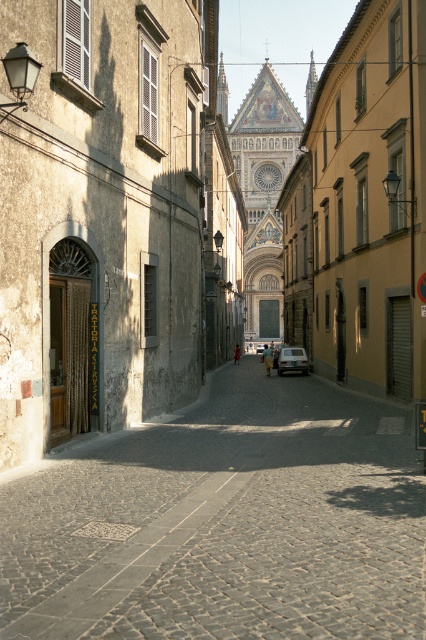
Question: In this image, where is stone paved street at center located relative to gray cobblestone alley at center?

Choices:
 (A) below
 (B) above

Answer: (B)

Question: Considering the real-world distances, which object is farthest from the silver metallic car at center?

Choices:
 (A) gray cobblestone alley at center
 (B) stone paved street at center

Answer: (A)

Question: Which point appears farthest from the camera in this image?

Choices:
 (A) (388, 540)
 (B) (161, 328)

Answer: (B)

Question: Is stone paved street at center further to the viewer compared to silver metallic car at center?

Choices:
 (A) yes
 (B) no

Answer: (B)

Question: Which point is closer to the camera taking this photo?

Choices:
 (A) (129, 444)
 (B) (288, 358)
 (C) (140, 305)

Answer: (A)

Question: Is stone paved street at center thinner than gray cobblestone alley at center?

Choices:
 (A) yes
 (B) no

Answer: (B)